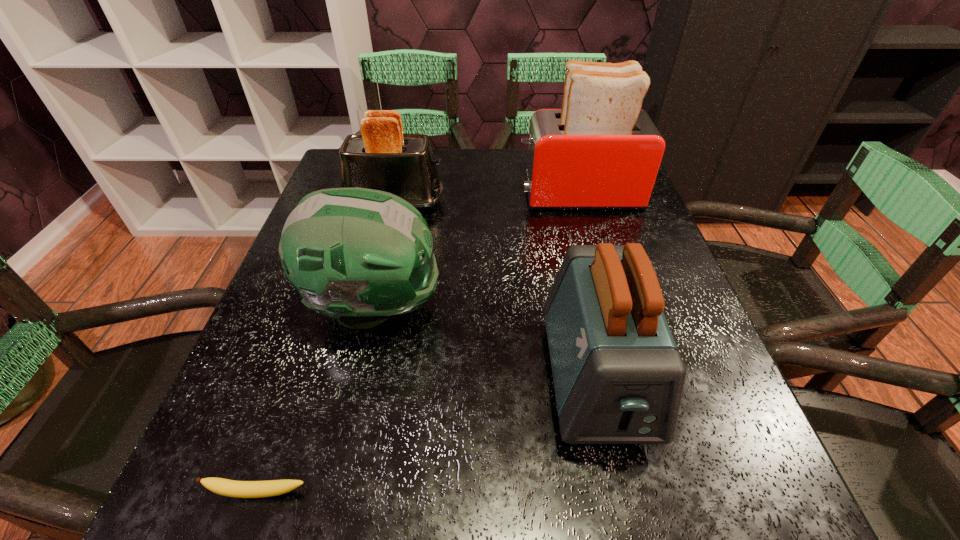
The width and height of the screenshot is (960, 540). What are the coordinates of `the tallest toaster` in the screenshot? It's located at (601, 151).

Find the location of a particular element. This screenshot has width=960, height=540. the nearest toaster is located at coordinates (618, 377).

Identify the location of football helmet. (357, 255).

This screenshot has height=540, width=960. Find the location of `the leftmost toaster`. the leftmost toaster is located at coordinates (382, 157).

At what (x,y) coordinates should I click in order to perform the action: click on the shortest object. Please return your answer as a coordinate pair (x, y). Looking at the image, I should click on (241, 489).

Identify the location of banana. This screenshot has height=540, width=960. 241,489.

In order to click on vacant space situated on the front-facing side of the tallest object in this screenshot , I will do `click(410, 195)`.

Image resolution: width=960 pixels, height=540 pixels. What are the coordinates of `vacant space located 0.140m on the front-facing side of the tallest object` in the screenshot? It's located at (462, 195).

At what (x,y) coordinates should I click in order to perform the action: click on vacant space located 0.170m on the front-facing side of the tallest object. Please return your answer as a coordinate pair (x, y). The width and height of the screenshot is (960, 540). Looking at the image, I should click on (449, 195).

The image size is (960, 540). I want to click on free space located 0.290m on the visor of the football helmet, so tap(595, 307).